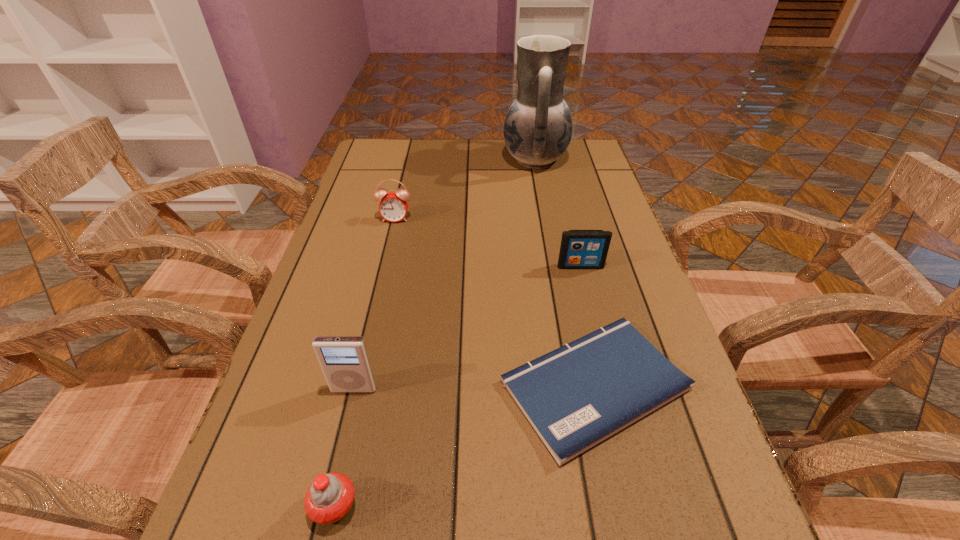
Identify the location of free space located on the front-facing side of the farthest object. click(x=386, y=160).

What are the coordinates of `free space located 0.390m on the front-facing side of the farthest object` in the screenshot? It's located at (379, 160).

I want to click on vacant space located 0.060m on the front-facing side of the second tallest object, so click(346, 426).

The width and height of the screenshot is (960, 540). Identify the location of vacant space located 0.130m on the clock face of the alarm clock. (387, 256).

Locate an element on the screen. vacant space located 0.270m on the front screen of the fourth nearest object is located at coordinates (606, 367).

I want to click on free region located on the back of the nearest object, so click(x=348, y=450).

Identify the location of vacant space situated on the back of the paperback book. (558, 217).

Locate an element on the screen. The image size is (960, 540). object that is at the far edge is located at coordinates (538, 126).

Identify the location of iPod located at the left edge. Image resolution: width=960 pixels, height=540 pixels. (344, 360).

Identify the location of alarm clock present at the left edge. The image size is (960, 540). (393, 206).